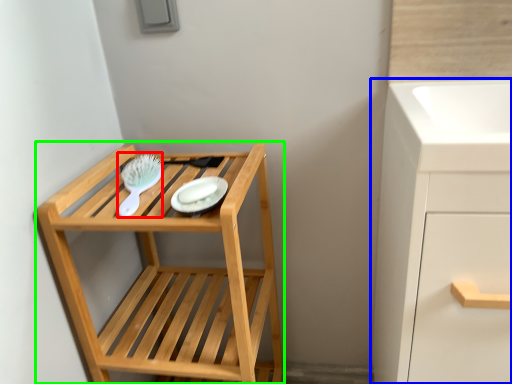
Question: Considering the real-world distances, which object is farthest from brush (highlighted by a red box)? bathroom cabinet (highlighted by a blue box) or furniture (highlighted by a green box)?

Choices:
 (A) bathroom cabinet
 (B) furniture

Answer: (A)